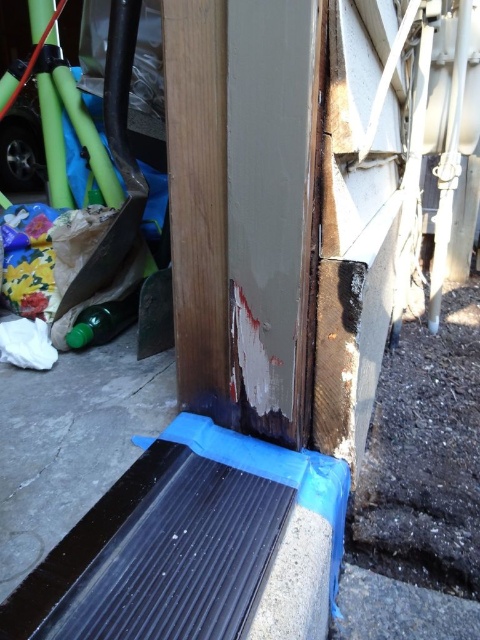
You are standing in front of the weathered wall and see two points marked on it. The first point is at coordinates point [78,410] and the second is at point [130,321]. Which point is closer to you?

Point [78,410] is in front of point [130,321], so it is closer to you.

In the scene shown: You are a delivery person trying to place a small package on the smooth concrete at lower center. However, there is a green translucent bottle at lower left nearby. Which surface has enough space to accommodate the package?

The smooth concrete at lower center has a larger width than the green translucent bottle at lower left, so the smooth concrete at lower center can accommodate the package.